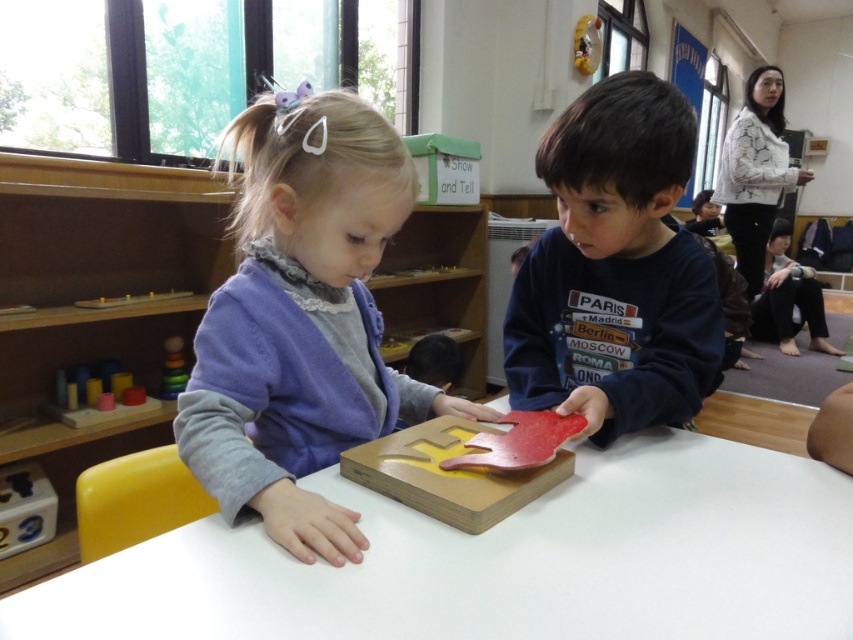
You are a teacher observing the classroom scene. You notice the matte blue shirt at center and the wooden toy at left. Which object takes up more space in the image?

The matte blue shirt at center is larger in size than the wooden toy at left, so it takes up more space in the image.

You are a teacher observing the classroom. You need to place a new item on the table between the matte blue shirt at center and the wooden toy at left. If the new item requires 30 cm of space, can you fit it there?

The matte blue shirt at center might be wider than wooden toy at left, so there might not be enough space to fit the new item requiring 30 cm between them. Check the actual width before placing.